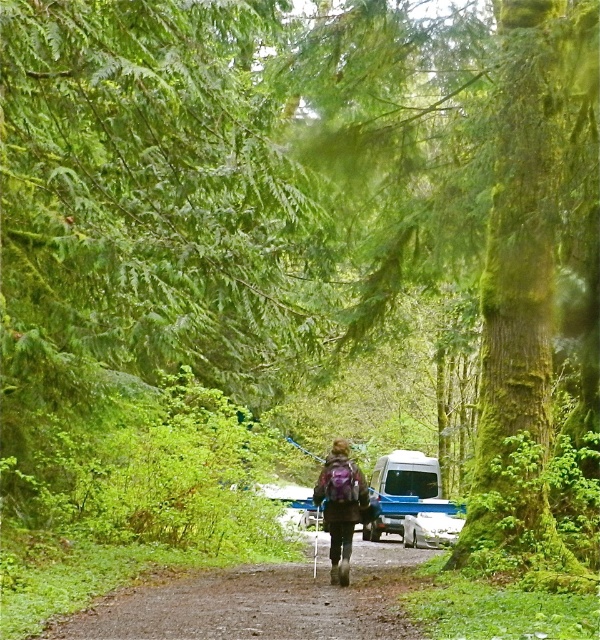
Which is more to the right, white matte camper van at center or purple fabric backpack at center?

Positioned to the right is white matte camper van at center.

Can you confirm if white matte camper van at center is shorter than purple fabric backpack at center?

No.

Where is `white matte camper van at center`? This screenshot has height=640, width=600. white matte camper van at center is located at coordinates (412, 500).

Find the location of a particular element. white matte camper van at center is located at coordinates (412, 500).